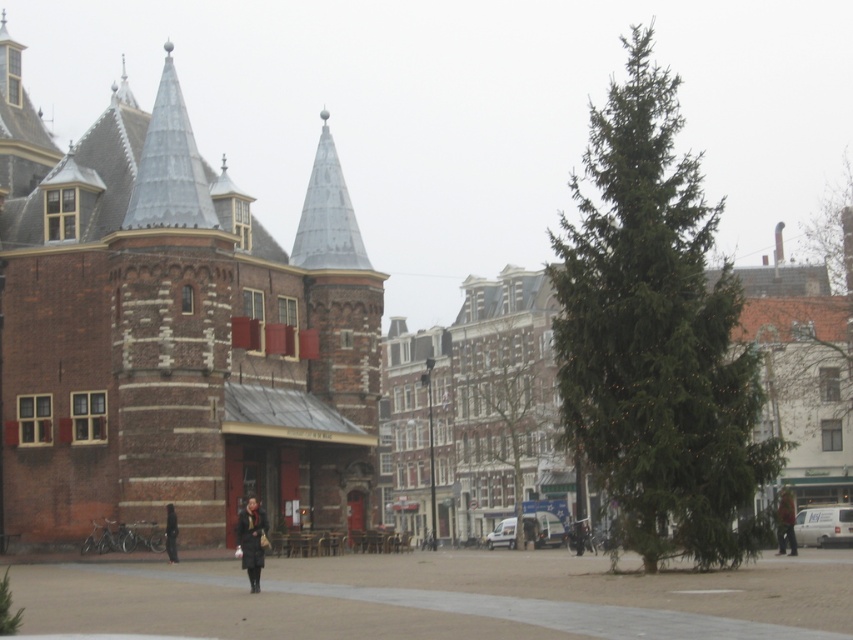
You are a delivery person who needs to place a large package between the green matte tree at upper right and the dark gray coat at center. Considering their widths, which object should you position the package closer to ensure it fits?

The green matte tree at upper right is wider than the dark gray coat at center. Therefore, positioning the package closer to the dark gray coat at center would provide more space for the package to fit between them.

You are a pedestrian standing at the center of the scene. You see the green textured pine tree at right and the dark brown leather jacket at lower right. Which object is higher in the image?

The green textured pine tree at right is above the dark brown leather jacket at lower right, so it is higher in the image.

In the scene shown: You are a pedestrian standing in the middle of the paved area. You see the green textured pine tree at right and the dark brown leather jacket at lower right. Which object is nearer to you?

The green textured pine tree at right is closer to the viewer than the dark brown leather jacket at lower right, so the green textured pine tree at right is nearer to you.